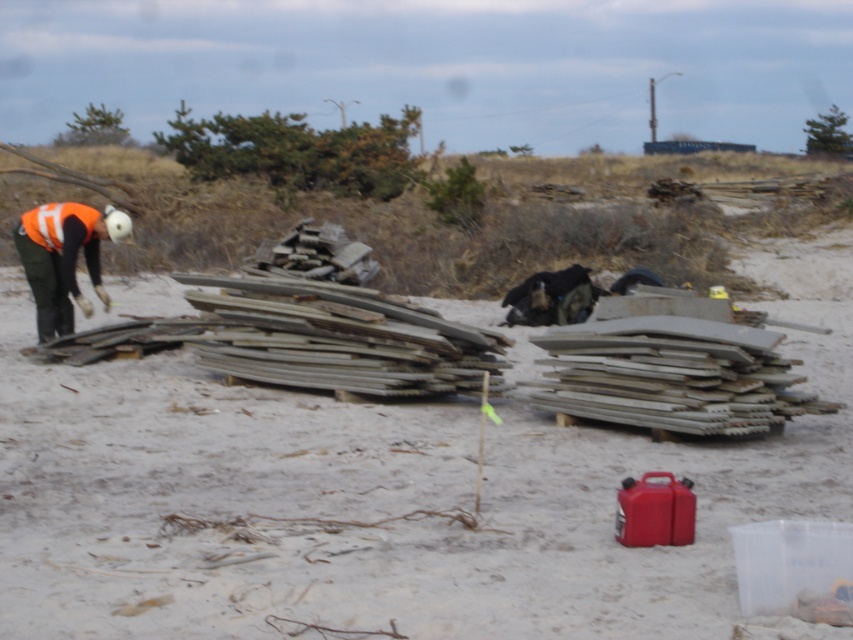
You are standing on the white sandy beach at center and want to walk to the orange reflective vest at left. Which direction should you go?

You should walk to the left because the white sandy beach at center is positioned on the right side of orange reflective vest at left, so moving left will take you towards the vest.

You are standing on the white sandy beach at center and looking towards the orange reflective vest at left. Which object is higher in your field of view?

The orange reflective vest at left is higher in your field of view because the white sandy beach at center is located below it.

You are a construction worker on the beach and need to move a heavy equipment from the orange reflective vest at left to the white sandy beach at center. Which area has a wider space to maneuver the equipment?

The white sandy beach at center has a larger width than the orange reflective vest at left, so it is more suitable for maneuvering heavy equipment.